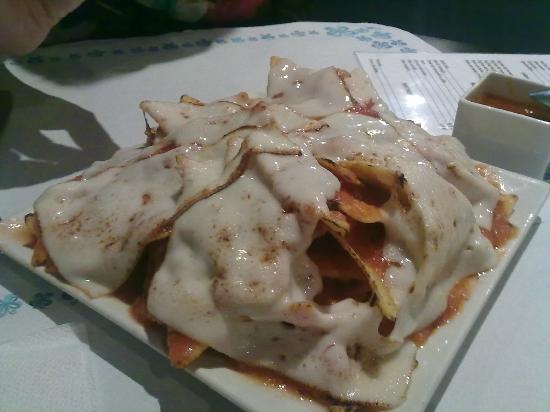
The image size is (550, 412). In order to click on plate in this screenshot , I will do `click(529, 202)`, `click(433, 358)`, `click(279, 402)`.